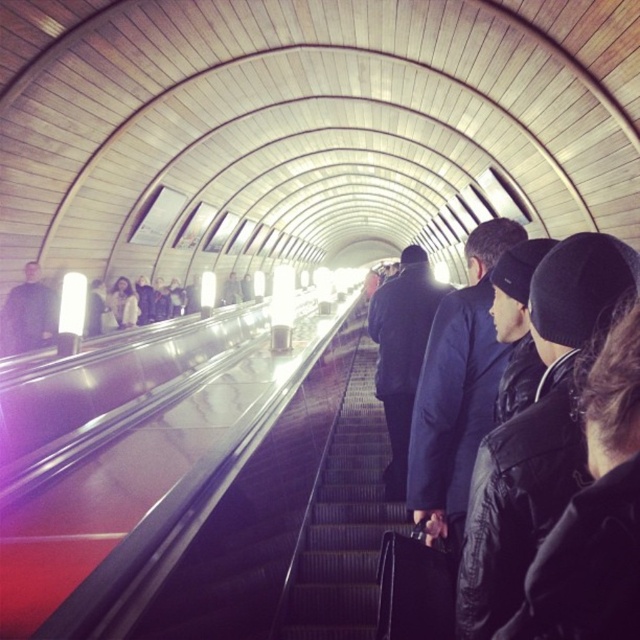
Question: Observing the image, what is the correct spatial positioning of metallic gray stairs at center in reference to black leather jacket at center?

Choices:
 (A) right
 (B) left

Answer: (B)

Question: Is black matte jacket at center above dark blue coat at center?

Choices:
 (A) no
 (B) yes

Answer: (B)

Question: Which point is closer to the camera?

Choices:
 (A) dark blue coat at center
 (B) black leather jacket at center

Answer: (B)

Question: Which is farther from the dark blue coat at center?

Choices:
 (A) dark blue jacket at left
 (B) black matte jacket at center
 (C) metallic gray stairs at center
 (D) black leather jacket at center

Answer: (A)

Question: Is black matte jacket at center positioned behind black leather jacket at center?

Choices:
 (A) no
 (B) yes

Answer: (A)

Question: Based on their relative distances, which object is farther from the black leather jacket at center?

Choices:
 (A) black matte jacket at center
 (B) dark blue jacket at left

Answer: (B)